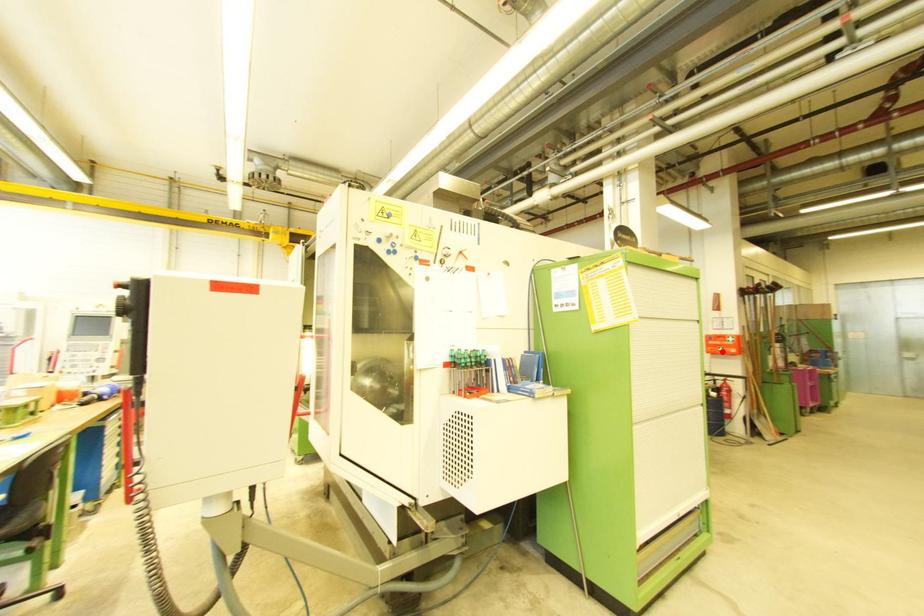
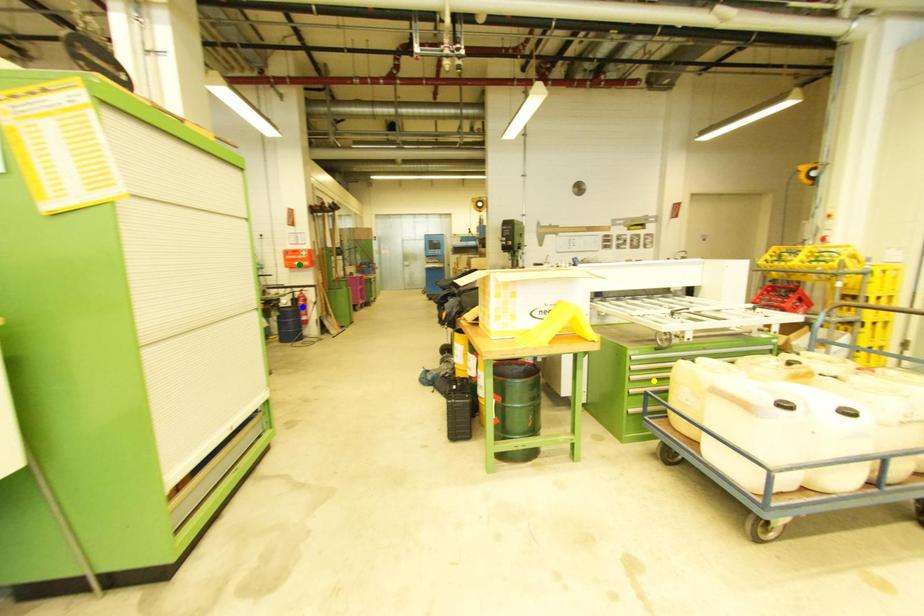
Question: I am providing you with two images of the same scene from different viewpoints. A red point is marked on the first image. You are given multiple points on the second image. Which spot in image 2 lines up with the point in image 1?

Choices:
 (A) blue point
 (B) green point
 (C) yellow point

Answer: (B)